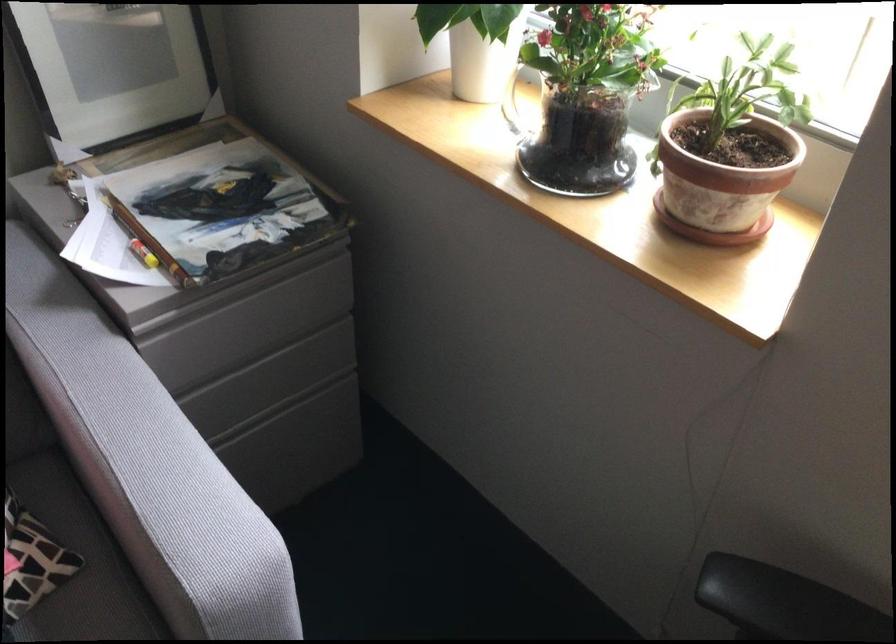
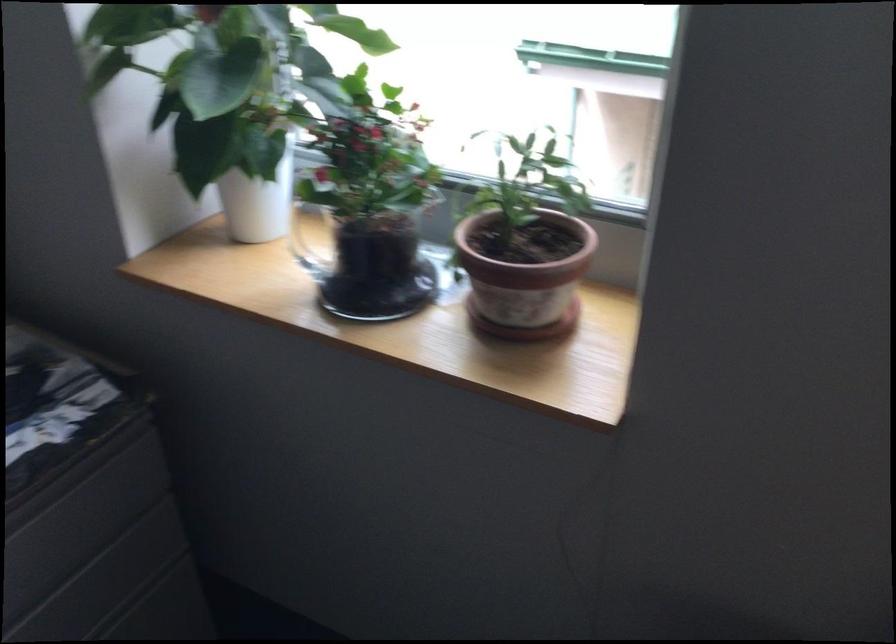
Question: The camera is either moving clockwise (left) or counter-clockwise (right) around the object. The first image is from the beginning of the video and the second image is from the end. Is the camera moving left or right when shooting the video?

Choices:
 (A) Left
 (B) Right

Answer: (A)